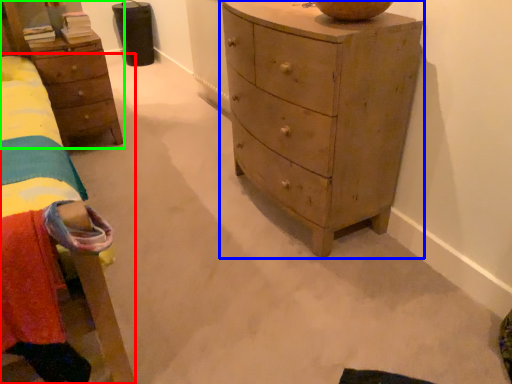
Question: Based on their relative distances, which object is nearer to bed (highlighted by a red box)? Choose from chest of drawers (highlighted by a blue box) and nightstand (highlighted by a green box).

Choices:
 (A) chest of drawers
 (B) nightstand

Answer: (B)